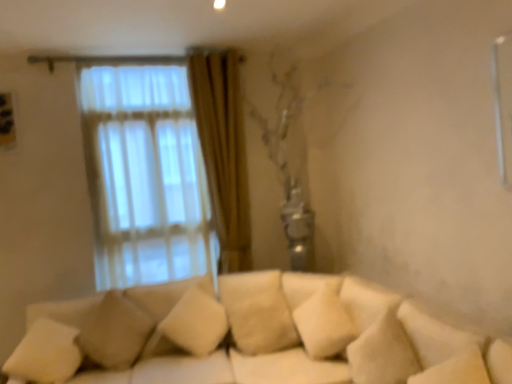
Question: Do you think beige fabric pillow at lower left, which is the 2th pillow from left to right, is within beige fabric pillow at center, the third pillow when ordered from left to right, or outside of it?

Choices:
 (A) outside
 (B) inside

Answer: (A)

Question: In terms of height, does beige fabric pillow at lower left, which is the 2th pillow from left to right, look taller or shorter compared to beige fabric pillow at center, the third pillow when ordered from left to right?

Choices:
 (A) short
 (B) tall

Answer: (B)

Question: Which object is the farthest from the beige fabric pillow at center, the first pillow from the right?

Choices:
 (A) beige fabric pillow at lower left, which is the 2th pillow from left to right
 (B) white soft pillow at lower left, which appears as the 3th pillow when viewed from the right

Answer: (B)

Question: Which of these objects is positioned farthest from the white soft pillow at lower left, which is the 1th pillow in left-to-right order?

Choices:
 (A) beige fabric pillow at lower left, the second pillow viewed from the right
 (B) beige fabric pillow at center, the first pillow from the right

Answer: (B)